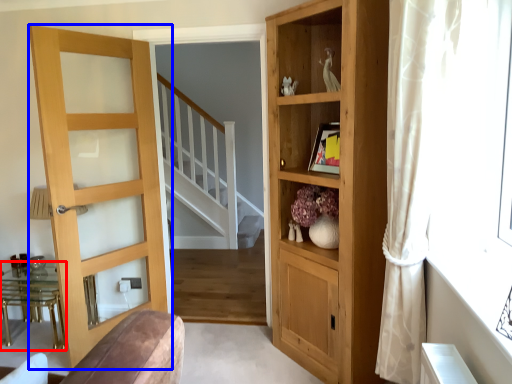
Question: Which of the following is the farthest to the observer, table (highlighted by a red box) or door (highlighted by a blue box)?

Choices:
 (A) table
 (B) door

Answer: (A)